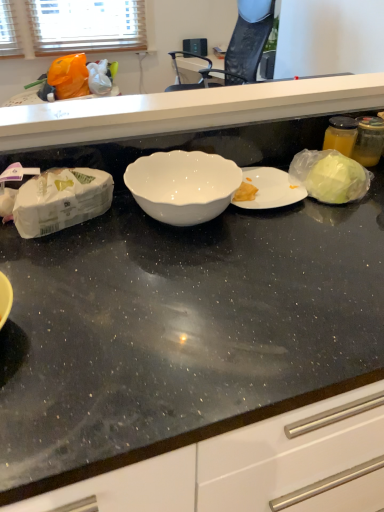
At what (x,y) coordinates should I click in order to perform the action: click on white glossy bowl at center. Please return your answer as a coordinate pair (x, y). This screenshot has height=512, width=384. Looking at the image, I should click on (183, 185).

Looking at this image, measure the distance between point (184, 210) and camera.

30.47 inches.

Measure the distance between white glossy bowl at center and camera.

77.22 centimeters.

Describe the element at coordinates (183, 185) in the screenshot. The height and width of the screenshot is (512, 384). I see `white glossy bowl at center` at that location.

The height and width of the screenshot is (512, 384). Find the location of `white glossy countertop at center`. white glossy countertop at center is located at coordinates (184, 110).

Describe the element at coordinates (184, 110) in the screenshot. This screenshot has width=384, height=512. I see `white glossy countertop at center` at that location.

Find the location of `white glossy bowl at center`. white glossy bowl at center is located at coordinates (183, 185).

Visually, is white glossy countertop at center positioned to the left or to the right of white glossy bowl at center?

From the image, it's evident that white glossy countertop at center is to the right of white glossy bowl at center.

Does white glossy countertop at center lie behind white glossy bowl at center?

Yes, white glossy countertop at center is behind white glossy bowl at center.

Considering the positions of points (195, 126) and (213, 158), is point (195, 126) closer to camera compared to point (213, 158)?

No, it is behind (213, 158).

From the image's perspective, is white glossy countertop at center below white glossy bowl at center?

Incorrect, from the image's perspective, white glossy countertop at center is higher than white glossy bowl at center.

From a real-world perspective, between white glossy countertop at center and white glossy bowl at center, who is vertically lower?

From a 3D spatial view, white glossy bowl at center is below.

Between white glossy countertop at center and white glossy bowl at center, which one has larger width?

Wider between the two is white glossy bowl at center.

Who is taller, white glossy countertop at center or white glossy bowl at center?

white glossy countertop at center.

In terms of size, does white glossy countertop at center appear bigger or smaller than white glossy bowl at center?

Clearly, white glossy countertop at center is larger in size than white glossy bowl at center.

Is white glossy countertop at center not within white glossy bowl at center?

white glossy countertop at center lies outside white glossy bowl at center's area.

Is white glossy countertop at center in contact with white glossy bowl at center?

white glossy countertop at center is not next to white glossy bowl at center, and they're not touching.

Does white glossy countertop at center turn towards white glossy bowl at center?

No, white glossy countertop at center is not oriented towards white glossy bowl at center.

Can you tell me how much white glossy countertop at center and white glossy bowl at center differ in facing direction?

There is a 178-degree angle between the facing directions of white glossy countertop at center and white glossy bowl at center.

The image size is (384, 512). What are the coordinates of `countertop above the white glossy bowl at center (from a real-world perspective)` in the screenshot? It's located at (184, 110).

From the picture: Which is more to the right, white glossy bowl at center or white glossy countertop at center?

white glossy countertop at center is more to the right.

Looking at this image, is white glossy bowl at center positioned behind white glossy countertop at center?

No, white glossy bowl at center is closer to the camera.

Which point is more distant from viewer, (183, 166) or (165, 126)?

The point (183, 166) is behind.

From the image's perspective, is white glossy bowl at center located above or below white glossy countertop at center?

Clearly, from the image's perspective, white glossy bowl at center is below white glossy countertop at center.

From a real-world perspective, is white glossy bowl at center beneath white glossy countertop at center?

Yes, from a real-world perspective, white glossy bowl at center is under white glossy countertop at center.

In terms of width, does white glossy bowl at center look wider or thinner when compared to white glossy countertop at center?

white glossy bowl at center is wider than white glossy countertop at center.

Considering the relative sizes of white glossy bowl at center and white glossy countertop at center in the image provided, is white glossy bowl at center taller than white glossy countertop at center?

In fact, white glossy bowl at center may be shorter than white glossy countertop at center.

Can you confirm if white glossy bowl at center is bigger than white glossy countertop at center?

Actually, white glossy bowl at center might be smaller than white glossy countertop at center.

Would you say white glossy bowl at center is inside or outside white glossy countertop at center?

white glossy bowl at center cannot be found inside white glossy countertop at center.

Based on the photo, is white glossy bowl at center not near white glossy countertop at center?

No, white glossy bowl at center is not far away from white glossy countertop at center.

Is white glossy bowl at center oriented away from white glossy countertop at center?

No, white glossy bowl at center is not facing the opposite direction of white glossy countertop at center.

At what (x,y) coordinates should I click in order to perform the action: click on countertop above the white glossy bowl at center (from a real-world perspective). Please return your answer as a coordinate pair (x, y). Looking at the image, I should click on (184, 110).

In the image, there is a white glossy countertop at center. Where is `bowl below it (from a real-world perspective)`? Image resolution: width=384 pixels, height=512 pixels. bowl below it (from a real-world perspective) is located at coordinates click(183, 185).

The width and height of the screenshot is (384, 512). In order to click on countertop lying behind the white glossy bowl at center in this screenshot , I will do `click(184, 110)`.